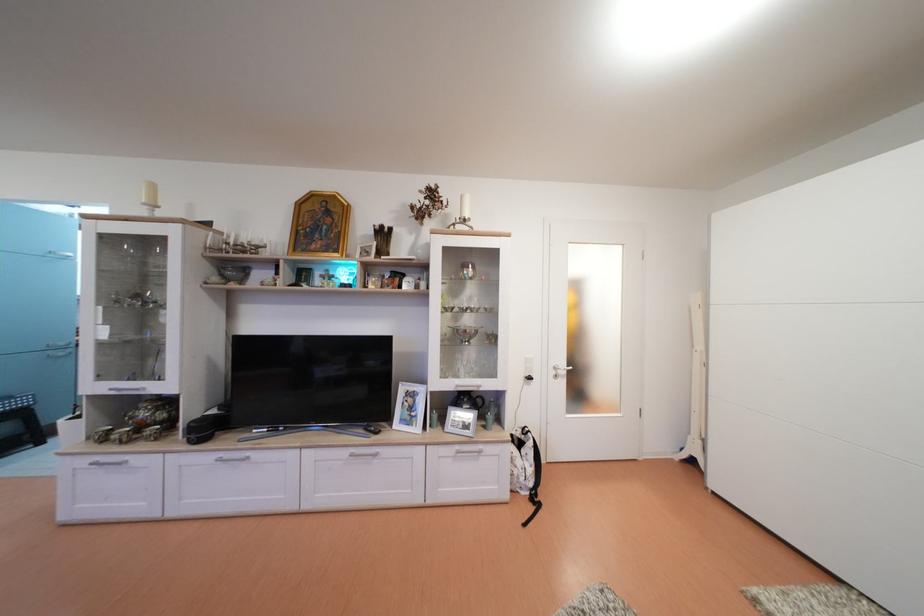
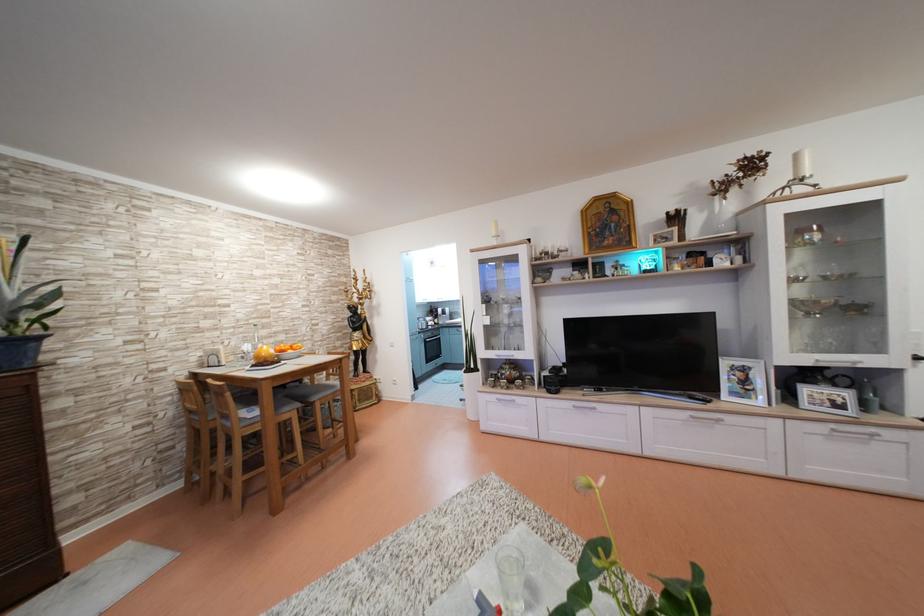
Which direction would the cameraman need to move to produce the second image?

The movement direction of the cameraman is left, backward.